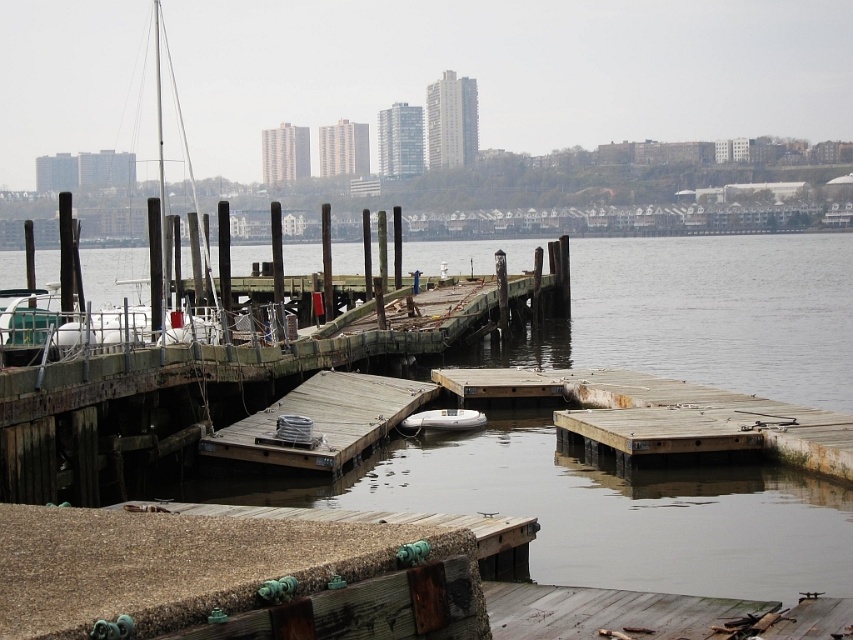
Is rusty wood dock at center closer to the viewer compared to white rubber boat at center?

That is True.

Between rusty wood dock at center and white rubber boat at center, which one has more height?

rusty wood dock at center is taller.

Between point (582, 387) and point (434, 410), which one is positioned behind?

The point (582, 387) is behind.

Identify the location of rusty wood dock at center. (665, 416).

Can you confirm if rusty wood dock at center is thinner than white matte sailboat at left?

Yes.

The image size is (853, 640). I want to click on rusty wood dock at center, so click(x=665, y=416).

Is the position of rusty wood dock at center more distant than that of weathered wood dock at center?

No, it is in front of weathered wood dock at center.

Can you confirm if rusty wood dock at center is thinner than weathered wood dock at center?

Incorrect, rusty wood dock at center's width is not less than weathered wood dock at center's.

This screenshot has width=853, height=640. Describe the element at coordinates (665, 416) in the screenshot. I see `rusty wood dock at center` at that location.

Find the location of a particular element. The image size is (853, 640). rusty wood dock at center is located at coordinates (665, 416).